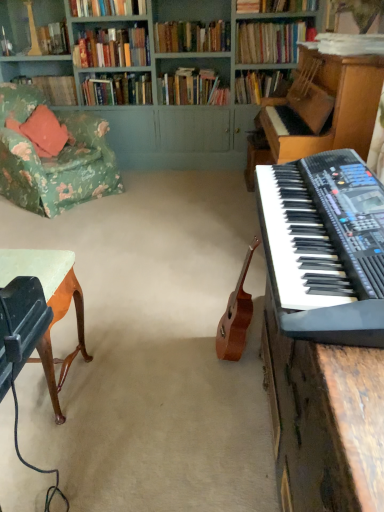
Question: Is hardcover book at upper left, the tenth book in the front-to-back sequence, outside of hardcover book at upper center, the 4th book positioned from the back?

Choices:
 (A) no
 (B) yes

Answer: (B)

Question: Are hardcover book at upper left, arranged as the 1th book when viewed from the back, and hardcover book at upper center, the 4th book positioned from the back, beside each other?

Choices:
 (A) no
 (B) yes

Answer: (A)

Question: Does hardcover book at upper left, the tenth book in the front-to-back sequence, have a greater width compared to hardcover book at upper center, the 4th book positioned from the back?

Choices:
 (A) no
 (B) yes

Answer: (A)

Question: From a real-world perspective, is hardcover book at upper left, the tenth book in the front-to-back sequence, beneath hardcover book at upper center, the 4th book positioned from the back?

Choices:
 (A) no
 (B) yes

Answer: (A)

Question: Is hardcover book at upper left, arranged as the 1th book when viewed from the back, further to the viewer compared to hardcover book at upper center, the 4th book positioned from the back?

Choices:
 (A) no
 (B) yes

Answer: (B)

Question: From the image's perspective, would you say hardcover book at upper left, arranged as the 1th book when viewed from the back, is shown under hardcover book at upper center, marked as the 7th book in a front-to-back arrangement?

Choices:
 (A) no
 (B) yes

Answer: (A)

Question: Does hardcover book at upper left, the tenth book in the front-to-back sequence, touch light brown wood desk at lower left?

Choices:
 (A) no
 (B) yes

Answer: (A)

Question: Considering the relative sizes of hardcover book at upper left, arranged as the 1th book when viewed from the back, and light brown wood desk at lower left in the image provided, is hardcover book at upper left, arranged as the 1th book when viewed from the back, shorter than light brown wood desk at lower left?

Choices:
 (A) yes
 (B) no

Answer: (A)

Question: Does hardcover book at upper left, arranged as the 1th book when viewed from the back, have a larger size compared to light brown wood desk at lower left?

Choices:
 (A) yes
 (B) no

Answer: (B)

Question: Is hardcover book at upper left, arranged as the 1th book when viewed from the back, smaller than light brown wood desk at lower left?

Choices:
 (A) yes
 (B) no

Answer: (A)

Question: From the image's perspective, does hardcover book at upper left, arranged as the 1th book when viewed from the back, appear higher than light brown wood desk at lower left?

Choices:
 (A) yes
 (B) no

Answer: (A)

Question: Is hardcover book at upper left, the tenth book in the front-to-back sequence, further to camera compared to light brown wood desk at lower left?

Choices:
 (A) no
 (B) yes

Answer: (B)

Question: Can you confirm if hardcover books at upper center, acting as the third book starting from the front, is wider than hardcover books at center, the 8th book when ordered from front to back?

Choices:
 (A) no
 (B) yes

Answer: (A)